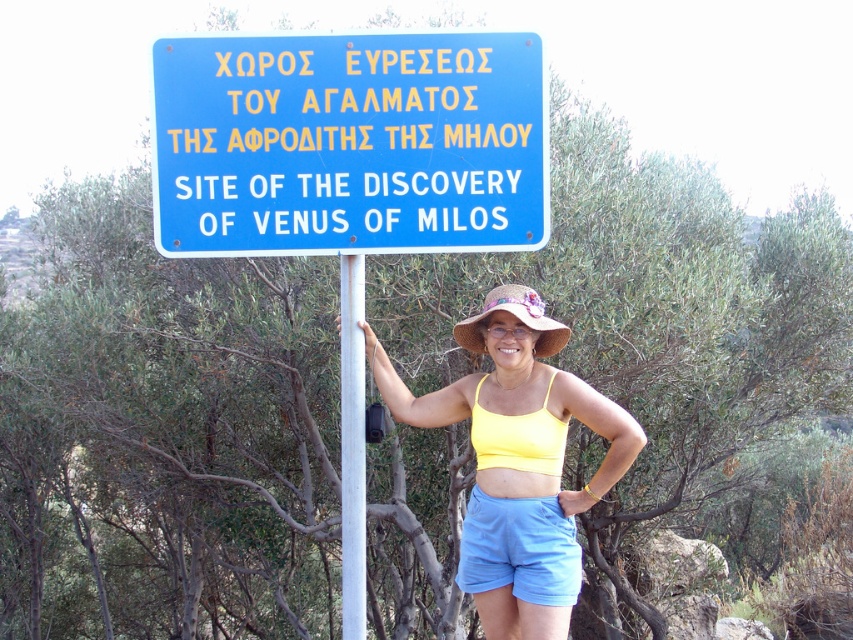
You are a fashion designer observing the scene. You notice the yellow fabric top at center and the white metallic pole at center. Which object is wider?

The yellow fabric top at center is wider than the white metallic pole at center.

You are a tourist standing in front of the sign. You notice the light blue fabric shorts at center and the white metallic pole at center. Which object is taller?

The white metallic pole at center is taller than the light blue fabric shorts at center.